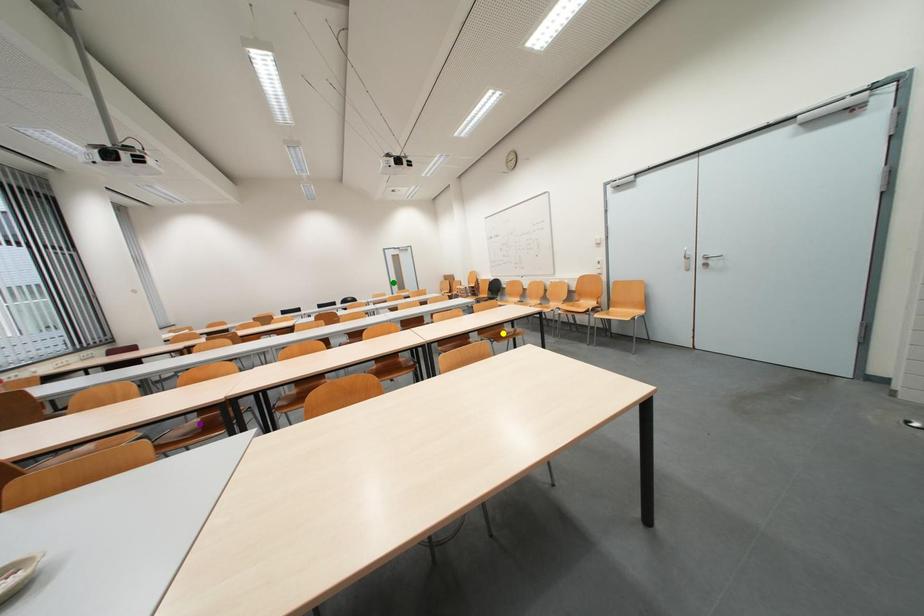
Order these from nearest to farthest:
A) purple point
B) yellow point
C) green point

1. green point
2. yellow point
3. purple point